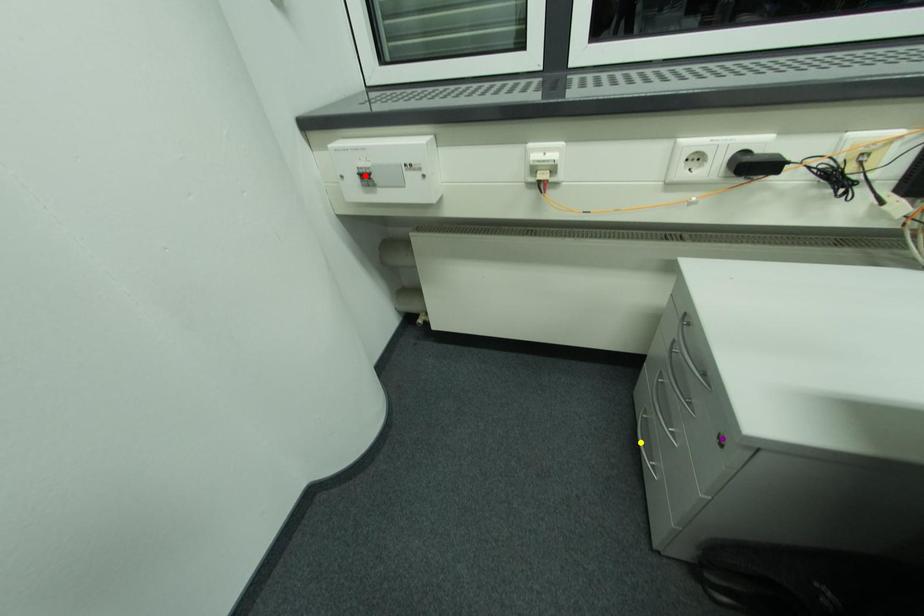
Order these from nearest to farthest:
A) red point
B) yellow point
C) purple point

1. purple point
2. red point
3. yellow point